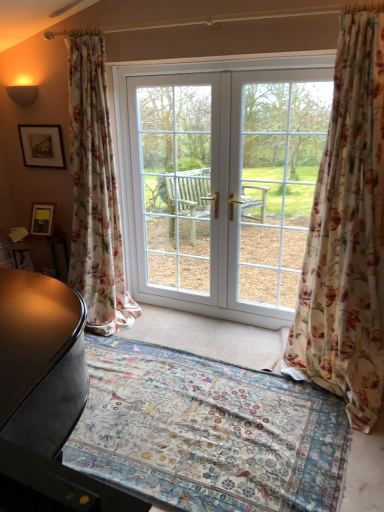
Question: Is floral fabric curtain at right, which ranks as the second curtain in left-to-right order, beside floral carpet at center?

Choices:
 (A) yes
 (B) no

Answer: (B)

Question: Does floral fabric curtain at right, which ranks as the second curtain in left-to-right order, have a greater width compared to floral carpet at center?

Choices:
 (A) yes
 (B) no

Answer: (B)

Question: Can floral carpet at center be found inside floral fabric curtain at right, arranged as the first curtain when viewed from the right?

Choices:
 (A) no
 (B) yes

Answer: (A)

Question: Is floral fabric curtain at right, which ranks as the second curtain in left-to-right order, positioned with its back to floral carpet at center?

Choices:
 (A) no
 (B) yes

Answer: (A)

Question: Considering the relative sizes of floral fabric curtain at right, arranged as the first curtain when viewed from the right, and floral carpet at center in the image provided, is floral fabric curtain at right, arranged as the first curtain when viewed from the right, thinner than floral carpet at center?

Choices:
 (A) no
 (B) yes

Answer: (B)

Question: Is white glossy door at center in front of or behind floral fabric curtain at right, which ranks as the second curtain in left-to-right order, in the image?

Choices:
 (A) front
 (B) behind

Answer: (B)

Question: In terms of width, does white glossy door at center look wider or thinner when compared to floral fabric curtain at right, which ranks as the second curtain in left-to-right order?

Choices:
 (A) wide
 (B) thin

Answer: (B)

Question: From the image's perspective, is white glossy door at center positioned above or below floral fabric curtain at right, arranged as the first curtain when viewed from the right?

Choices:
 (A) above
 (B) below

Answer: (A)

Question: Looking at the image, does white glossy door at center seem bigger or smaller compared to floral fabric curtain at right, arranged as the first curtain when viewed from the right?

Choices:
 (A) small
 (B) big

Answer: (A)

Question: Is floral fabric curtain at right, which ranks as the second curtain in left-to-right order, taller or shorter than floral carpet at center?

Choices:
 (A) short
 (B) tall

Answer: (B)

Question: Considering the positions of point (317, 286) and point (271, 507), is point (317, 286) closer or farther from the camera than point (271, 507)?

Choices:
 (A) closer
 (B) farther

Answer: (B)

Question: From the image's perspective, is floral fabric curtain at right, arranged as the first curtain when viewed from the right, positioned above or below floral carpet at center?

Choices:
 (A) above
 (B) below

Answer: (A)

Question: Looking at their shapes, would you say floral fabric curtain at right, which ranks as the second curtain in left-to-right order, is wider or thinner than floral carpet at center?

Choices:
 (A) thin
 (B) wide

Answer: (A)

Question: From a real-world perspective, is matte black picture frame at upper left above or below white glossy door at center?

Choices:
 (A) below
 (B) above

Answer: (B)

Question: Is matte black picture frame at upper left taller or shorter than white glossy door at center?

Choices:
 (A) short
 (B) tall

Answer: (A)